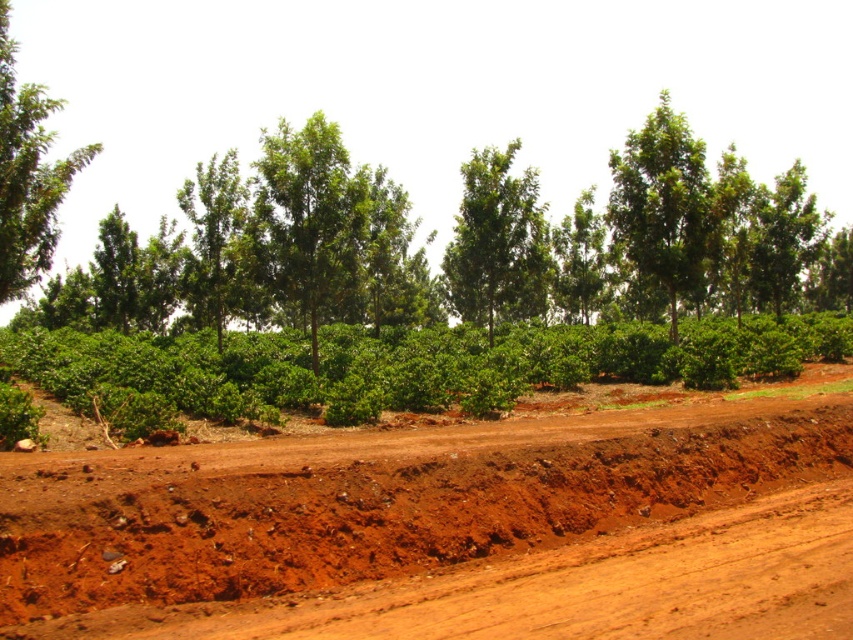
Question: Considering the real-world distances, which object is farthest from the green leafy tree at center?

Choices:
 (A) green leafy tree at upper left
 (B) brown soil at center
 (C) green leafy tree at upper right

Answer: (A)

Question: Does green leafy tree at center appear over green leafy tree at upper left?

Choices:
 (A) yes
 (B) no

Answer: (B)

Question: Does brown soil at center appear on the right side of green leafy tree at center?

Choices:
 (A) yes
 (B) no

Answer: (B)

Question: Which of the following is the farthest from the observer?

Choices:
 (A) brown soil at center
 (B) green leafy tree at upper left
 (C) green leafy tree at upper right
 (D) green leafy tree at center

Answer: (D)

Question: Which of the following is the farthest from the observer?

Choices:
 (A) green leafy tree at upper right
 (B) green leafy tree at center
 (C) brown soil at center

Answer: (B)

Question: Does green leafy tree at center come in front of green leafy tree at upper left?

Choices:
 (A) no
 (B) yes

Answer: (A)